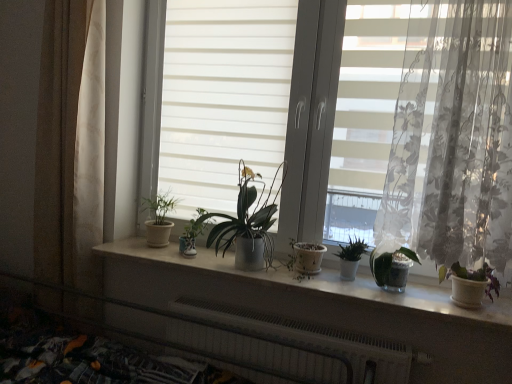
Question: Considering the relative sizes of green matte plant at center, which appears as the fourth houseplant when viewed from the left, and green matte plant at center, arranged as the fifth houseplant when viewed from the right, in the image provided, is green matte plant at center, which appears as the fourth houseplant when viewed from the left, bigger than green matte plant at center, arranged as the fifth houseplant when viewed from the right,?

Choices:
 (A) no
 (B) yes

Answer: (A)

Question: Is green matte plant at center, which appears as the fourth houseplant when viewed from the left, beside green matte plant at center, arranged as the fifth houseplant when viewed from the right?

Choices:
 (A) no
 (B) yes

Answer: (A)

Question: Does green matte plant at center, which appears as the fourth houseplant when viewed from the left, come in front of green matte plant at center, which ranks as the 2th houseplant in left-to-right order?

Choices:
 (A) yes
 (B) no

Answer: (A)

Question: Is green matte plant at center, which appears as the fourth houseplant when viewed from the left, shorter than green matte plant at center, which ranks as the 2th houseplant in left-to-right order?

Choices:
 (A) yes
 (B) no

Answer: (A)

Question: Considering the relative positions of green matte plant at center, which appears as the fourth houseplant when viewed from the left, and green matte plant at center, which ranks as the 2th houseplant in left-to-right order, in the image provided, is green matte plant at center, which appears as the fourth houseplant when viewed from the left, to the left of green matte plant at center, which ranks as the 2th houseplant in left-to-right order, from the viewer's perspective?

Choices:
 (A) no
 (B) yes

Answer: (A)

Question: In terms of height, does green matte plant at center, arranged as the fifth houseplant when viewed from the right, look taller or shorter compared to purple matte plant at right, the sixth houseplant from the left?

Choices:
 (A) short
 (B) tall

Answer: (B)

Question: Is green matte plant at center, arranged as the fifth houseplant when viewed from the right, in front of or behind purple matte plant at right, which is the first houseplant in right-to-left order, in the image?

Choices:
 (A) front
 (B) behind

Answer: (B)

Question: Which is correct: green matte plant at center, which ranks as the 2th houseplant in left-to-right order, is inside purple matte plant at right, the sixth houseplant from the left, or outside of it?

Choices:
 (A) inside
 (B) outside

Answer: (B)

Question: From a real-world perspective, is green matte plant at center, which ranks as the 2th houseplant in left-to-right order, positioned above or below purple matte plant at right, the sixth houseplant from the left?

Choices:
 (A) below
 (B) above

Answer: (B)

Question: From the image's perspective, is matte white pot at center, the fourth houseplant positioned from the right, positioned above or below translucent floral fabric at right, the 2th curtain in the back-to-front sequence?

Choices:
 (A) below
 (B) above

Answer: (A)

Question: Based on their sizes in the image, would you say matte white pot at center, which ranks as the third houseplant in left-to-right order, is bigger or smaller than translucent floral fabric at right, which is the first curtain from right to left?

Choices:
 (A) small
 (B) big

Answer: (A)

Question: Based on their positions, is matte white pot at center, which ranks as the third houseplant in left-to-right order, located to the left or right of translucent floral fabric at right, which is the first curtain from right to left?

Choices:
 (A) left
 (B) right

Answer: (A)

Question: From a real-world perspective, is matte white pot at center, which ranks as the third houseplant in left-to-right order, physically located above or below translucent floral fabric at right, the 2th curtain in the back-to-front sequence?

Choices:
 (A) below
 (B) above

Answer: (A)

Question: Visually, is white metallic radiator at lower center positioned to the left or to the right of beige fabric curtain at left, the second curtain positioned from the right?

Choices:
 (A) left
 (B) right

Answer: (B)

Question: From a real-world perspective, relative to beige fabric curtain at left, the second curtain in the front-to-back sequence, is white metallic radiator at lower center vertically above or below?

Choices:
 (A) below
 (B) above

Answer: (A)